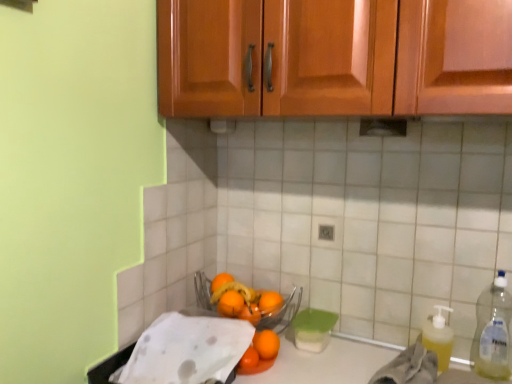
Question: From the image's perspective, would you say orange matte at center, acting as the 2th orange starting from the back, is positioned over clear plastic bottle at right?

Choices:
 (A) yes
 (B) no

Answer: (B)

Question: Is clear plastic bottle at right at the back of orange matte at center, acting as the 2th orange starting from the back?

Choices:
 (A) yes
 (B) no

Answer: (B)

Question: Is orange matte at center, acting as the 2th orange starting from the back, touching clear plastic bottle at right?

Choices:
 (A) no
 (B) yes

Answer: (A)

Question: Considering the relative sizes of orange matte at center, the 4th orange in the front-to-back sequence, and clear plastic bottle at right in the image provided, is orange matte at center, the 4th orange in the front-to-back sequence, smaller than clear plastic bottle at right?

Choices:
 (A) yes
 (B) no

Answer: (A)

Question: From the image's perspective, does orange matte at center, the 4th orange in the front-to-back sequence, appear lower than clear plastic bottle at right?

Choices:
 (A) no
 (B) yes

Answer: (B)

Question: Looking at their shapes, would you say white paper towel at lower left, which is the second material in right-to-left order, is wider or thinner than yellow translucent liquid at lower right, positioned as the first material in right-to-left order?

Choices:
 (A) thin
 (B) wide

Answer: (B)

Question: Would you say white paper towel at lower left, which is the second material in right-to-left order, is inside or outside yellow translucent liquid at lower right, positioned as the first material in right-to-left order?

Choices:
 (A) outside
 (B) inside

Answer: (A)

Question: In terms of size, does white paper towel at lower left, which is the second material in right-to-left order, appear bigger or smaller than yellow translucent liquid at lower right, positioned as the first material in right-to-left order?

Choices:
 (A) small
 (B) big

Answer: (B)

Question: Is white paper towel at lower left, which is the second material in right-to-left order, in front of or behind yellow translucent liquid at lower right, positioned as the first material in right-to-left order, in the image?

Choices:
 (A) behind
 (B) front

Answer: (B)

Question: In the image, is white paper towel at lower left, which is the second material in right-to-left order, positioned in front of or behind orange matte at center, the 3th orange positioned from the front?

Choices:
 (A) front
 (B) behind

Answer: (A)

Question: From a real-world perspective, is white paper towel at lower left, which is the first material from left to right, physically located above or below orange matte at center, arranged as the 3th orange when viewed from the back?

Choices:
 (A) above
 (B) below

Answer: (B)

Question: Is white paper towel at lower left, which is the first material from left to right, to the left or to the right of orange matte at center, arranged as the 3th orange when viewed from the back, in the image?

Choices:
 (A) left
 (B) right

Answer: (A)

Question: Choose the correct answer: Is white paper towel at lower left, which is the first material from left to right, inside orange matte at center, arranged as the 3th orange when viewed from the back, or outside it?

Choices:
 (A) inside
 (B) outside

Answer: (B)

Question: Is orange matte at center, the 4th orange in the front-to-back sequence, in front of or behind orange matte at center, the 5th orange from the back, in the image?

Choices:
 (A) behind
 (B) front

Answer: (A)

Question: From a real-world perspective, is orange matte at center, the 4th orange in the front-to-back sequence, above or below orange matte at center, which is the 1th orange in front-to-back order?

Choices:
 (A) below
 (B) above

Answer: (B)